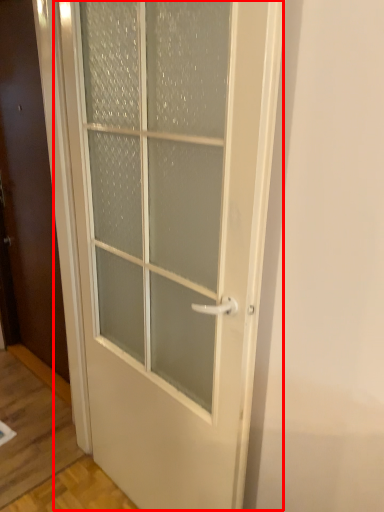
Question: Where is door (annotated by the red box) located in relation to door in the image?

Choices:
 (A) right
 (B) left

Answer: (A)